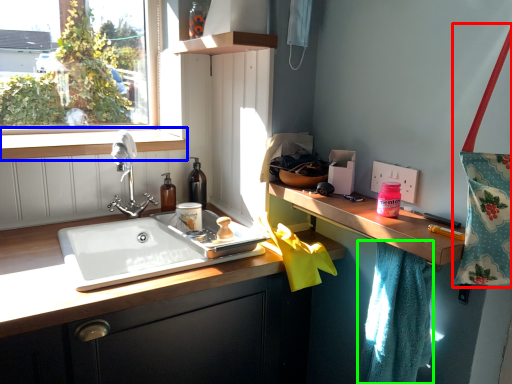
Question: Which is nearer to the tote bag (highlighted by a red box)? window sill (highlighted by a blue box) or bath towel (highlighted by a green box).

Choices:
 (A) window sill
 (B) bath towel

Answer: (B)